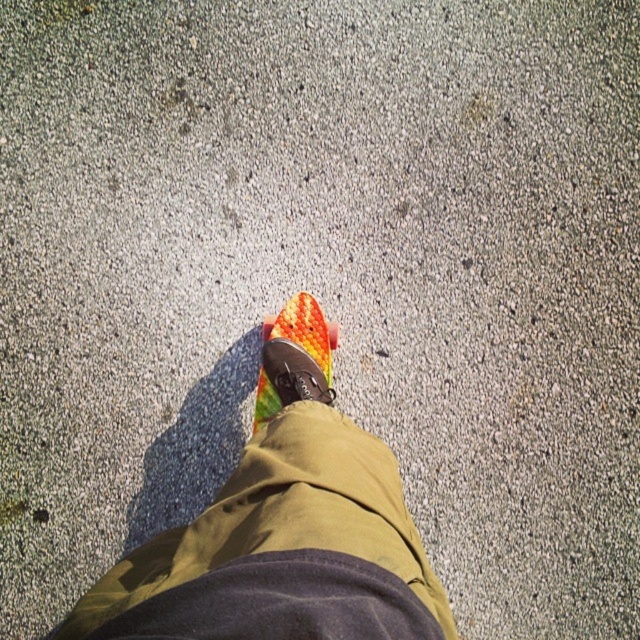
Question: Among these objects, which one is nearest to the camera?

Choices:
 (A) rubberized orange skateboard at center
 (B) orange textured toe at center
 (C) multicolored rubber shoe at center

Answer: (A)

Question: Which of the following is the farthest from the observer?

Choices:
 (A) orange textured toe at center
 (B) rubberized orange skateboard at center

Answer: (A)

Question: Is multicolored rubber shoe at center bigger than orange textured toe at center?

Choices:
 (A) no
 (B) yes

Answer: (B)

Question: Estimate the real-world distances between objects in this image. Which object is farther from the multicolored rubber shoe at center?

Choices:
 (A) orange textured toe at center
 (B) rubberized orange skateboard at center

Answer: (B)

Question: Does multicolored rubber shoe at center have a larger size compared to orange textured toe at center?

Choices:
 (A) yes
 (B) no

Answer: (A)

Question: Does rubberized orange skateboard at center have a greater width compared to multicolored rubber shoe at center?

Choices:
 (A) no
 (B) yes

Answer: (B)